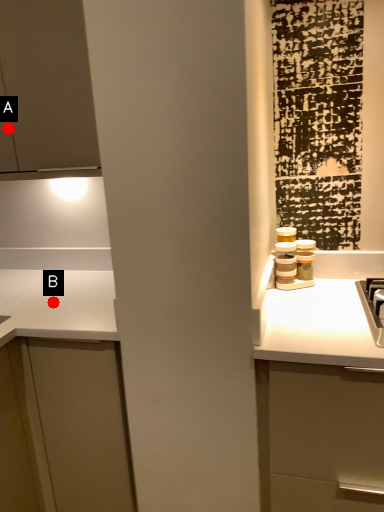
Question: Two points are circled on the image, labeled by A and B beside each circle. Which point is farther from the camera taking this photo?

Choices:
 (A) A is further
 (B) B is further

Answer: (A)